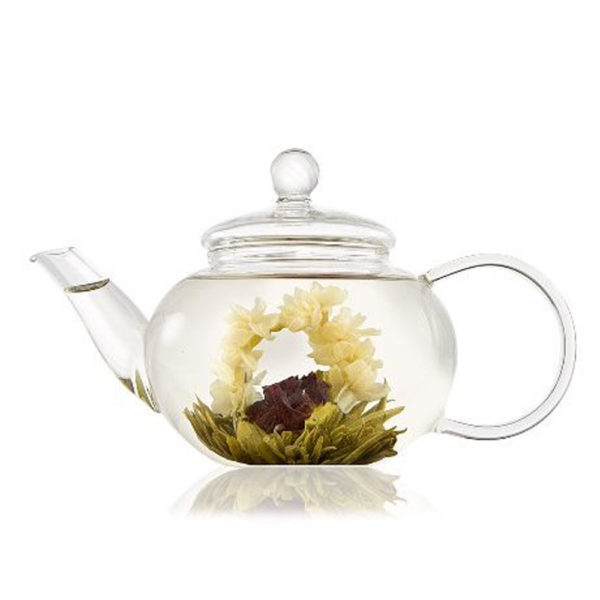
The height and width of the screenshot is (600, 600). In order to click on 1 teapot in this screenshot , I will do `click(413, 335)`.